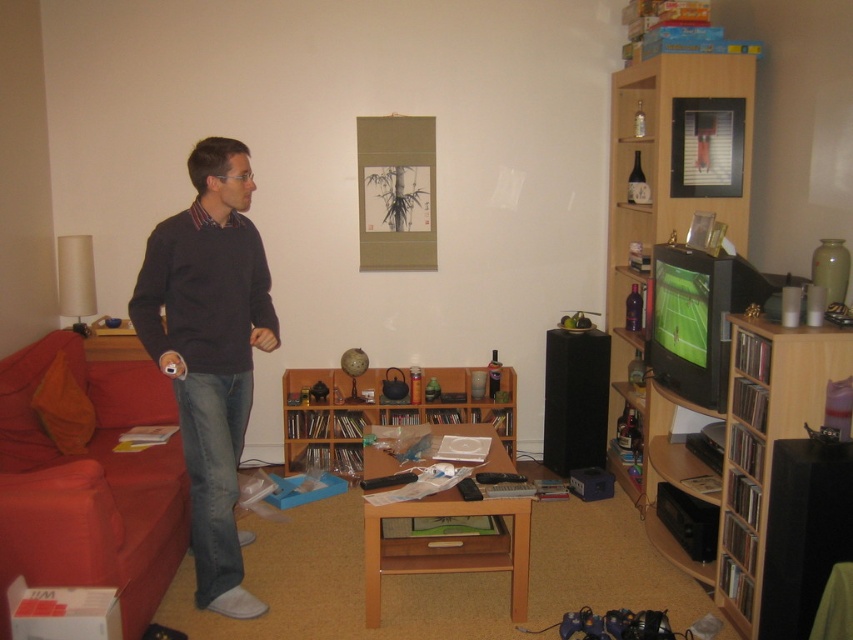
Question: Which point appears farthest from the camera in this image?

Choices:
 (A) (506, 452)
 (B) (757, 477)
 (C) (74, 536)

Answer: (A)

Question: Which object appears closest to the camera in this image?

Choices:
 (A) wooden bookshelf at right
 (B) red fabric couch at left

Answer: (B)

Question: Is red fabric couch at left behind wooden bookshelf at center?

Choices:
 (A) no
 (B) yes

Answer: (A)

Question: Does red fabric couch at left have a larger size compared to wooden bookshelf at right?

Choices:
 (A) no
 (B) yes

Answer: (B)

Question: Is dark gray sweater at left closer to camera compared to wooden bookshelf at center?

Choices:
 (A) yes
 (B) no

Answer: (A)

Question: Which object is the closest to the wooden bookshelf at center?

Choices:
 (A) dark gray sweater at left
 (B) wooden bookshelf at right
 (C) red fabric couch at left

Answer: (C)